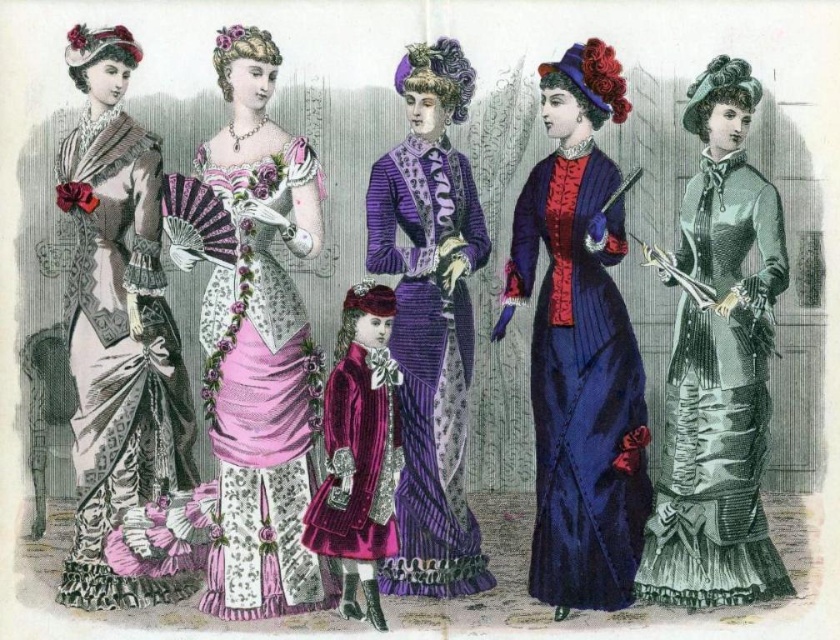
Is matte silver dress at left smaller than velvet maroon coat at center?

Incorrect, matte silver dress at left is not smaller in size than velvet maroon coat at center.

The height and width of the screenshot is (640, 840). What are the coordinates of `matte silver dress at left` in the screenshot? It's located at (118, 328).

Image resolution: width=840 pixels, height=640 pixels. In order to click on matte silver dress at left in this screenshot , I will do `click(118, 328)`.

Is silvery-green satin dress at right closer to camera compared to velvet maroon coat at center?

No, it is not.

Is silvery-green satin dress at right taller than velvet maroon coat at center?

Correct, silvery-green satin dress at right is much taller as velvet maroon coat at center.

Is point (676, 593) more distant than point (365, 589)?

Yes, it is behind point (365, 589).

The width and height of the screenshot is (840, 640). In order to click on silvery-green satin dress at right in this screenshot , I will do `click(718, 365)`.

Is velvet blue dress at center wider than velvet maroon coat at center?

Correct, the width of velvet blue dress at center exceeds that of velvet maroon coat at center.

Consider the image. Can you confirm if velvet blue dress at center is positioned to the left of velvet maroon coat at center?

In fact, velvet blue dress at center is to the right of velvet maroon coat at center.

Locate an element on the screen. velvet blue dress at center is located at coordinates (580, 346).